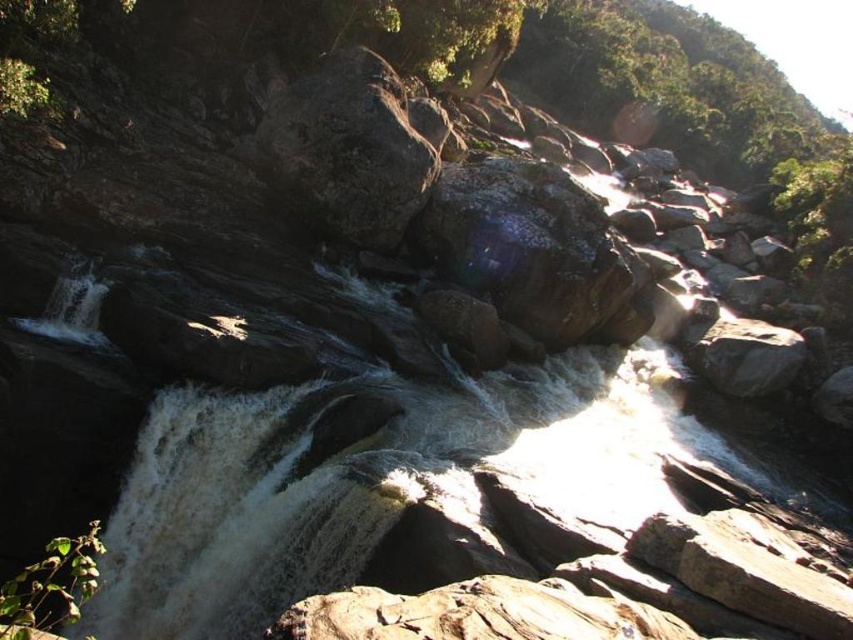
Consider the image. You are a hiker trying to cross the waterfall area. You see the glossy dark rock at center and the rough stone boulder at center. Which one has a wider surface to step on?

The glossy dark rock at center has a wider surface than the rough stone boulder at center, so it would provide a wider stepping area for crossing.

You are a hiker trying to cross the waterfall area. You notice two rocks in the center of the scene. The glossy dark rock at center and the rough stone boulder at center. Which rock should you step on first to safely climb upwards?

You should step on the rough stone boulder at center first because the glossy dark rock at center is located below it, providing a stable starting point for climbing upwards.

You are standing at the edge of the waterfall and want to place a small decorative statue between the glossy dark rock at center and the rough stone boulder at center. Which rock should you place it closer to if you want the statue to be more visible to visitors approaching from the front?

You should place the statue closer to the glossy dark rock at center because it is closer to the visitors, making the statue more visible.